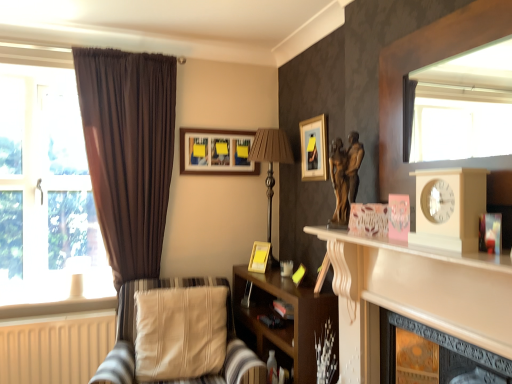
Question: Considering the positions of point (306, 170) and point (438, 238), is point (306, 170) closer or farther from the camera than point (438, 238)?

Choices:
 (A) closer
 (B) farther

Answer: (B)

Question: In the image, is matte gold picture frame at upper center, which is the 3th picture frame in left-to-right order, positioned in front of or behind beige wooden clock at right?

Choices:
 (A) behind
 (B) front

Answer: (A)

Question: Considering the real-world distances, which object is farthest from the bronze statue at center-right?

Choices:
 (A) matte gold picture frame at upper center, the second picture frame positioned from the top
 (B) beige fabric cushion at lower left
 (C) beige wooden clock at right
 (D) transparent glass window at left
 (E) brown wooden shelf at lower left

Answer: (D)

Question: Which is farther from the white glossy mantle at right?

Choices:
 (A) matte white lampshade at left, which ranks as the second lamp in top-to-bottom order
 (B) beige fabric cushion at lower left
 (C) white wood at lower left
 (D) beige wooden clock at right
 (E) transparent glass window at left

Answer: (A)